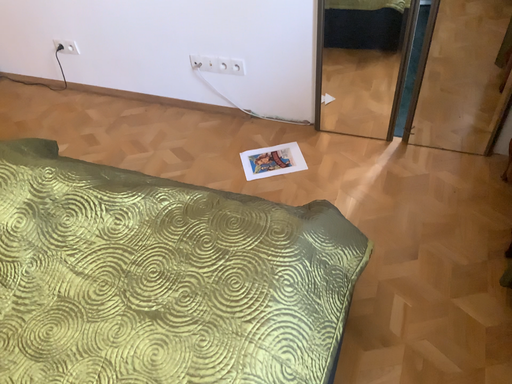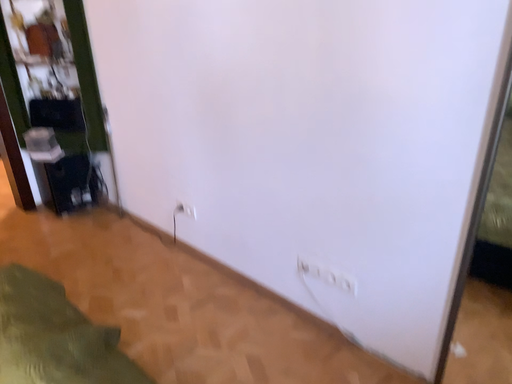
Question: Which way did the camera rotate in the video?

Choices:
 (A) rotated downward
 (B) rotated upward

Answer: (B)